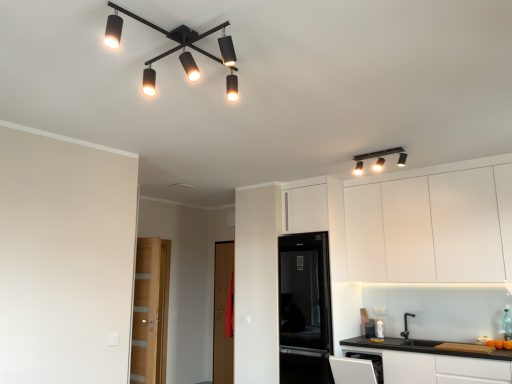
Question: Is brown wooden door at center aimed at white matte cabinet at upper right, which ranks as the first cabinetry in top-to-bottom order?

Choices:
 (A) no
 (B) yes

Answer: (A)

Question: Does brown wooden door at center come behind white matte cabinet at upper right, the 2th cabinetry when ordered from bottom to top?

Choices:
 (A) yes
 (B) no

Answer: (A)

Question: Would you consider brown wooden door at center to be distant from white matte cabinet at upper right, which ranks as the first cabinetry in top-to-bottom order?

Choices:
 (A) no
 (B) yes

Answer: (B)

Question: From a real-world perspective, is brown wooden door at center located beneath white matte cabinet at upper right, which ranks as the first cabinetry in top-to-bottom order?

Choices:
 (A) no
 (B) yes

Answer: (B)

Question: From the image's perspective, does brown wooden door at center appear lower than white matte cabinet at upper right, which ranks as the first cabinetry in top-to-bottom order?

Choices:
 (A) no
 (B) yes

Answer: (B)

Question: Based on their sizes in the image, would you say matte black light fixture at upper left is bigger or smaller than white matte cabinet at upper right, the 2th cabinetry when ordered from bottom to top?

Choices:
 (A) small
 (B) big

Answer: (A)

Question: In the image, is matte black light fixture at upper left positioned in front of or behind white matte cabinet at upper right, the 2th cabinetry when ordered from bottom to top?

Choices:
 (A) behind
 (B) front

Answer: (B)

Question: Is matte black light fixture at upper left situated inside white matte cabinet at upper right, which ranks as the first cabinetry in top-to-bottom order, or outside?

Choices:
 (A) outside
 (B) inside

Answer: (A)

Question: From a real-world perspective, relative to white matte cabinet at upper right, the 2th cabinetry when ordered from bottom to top, is matte black light fixture at upper left vertically above or below?

Choices:
 (A) above
 (B) below

Answer: (A)

Question: Choose the correct answer: Is white matte cabinet at lower right, arranged as the 1th cabinetry when ordered from the bottom, inside matte black light fixture at upper right or outside it?

Choices:
 (A) outside
 (B) inside

Answer: (A)

Question: In terms of height, does white matte cabinet at lower right, the 2th cabinetry from the top, look taller or shorter compared to matte black light fixture at upper right?

Choices:
 (A) short
 (B) tall

Answer: (B)

Question: Is white matte cabinet at lower right, the 2th cabinetry from the top, wider or thinner than matte black light fixture at upper right?

Choices:
 (A) thin
 (B) wide

Answer: (B)

Question: In the image, is white matte cabinet at lower right, the 2th cabinetry from the top, positioned in front of or behind matte black light fixture at upper right?

Choices:
 (A) front
 (B) behind

Answer: (A)

Question: Visually, is brown wooden door at center positioned to the left or to the right of light brown wooden door at left?

Choices:
 (A) left
 (B) right

Answer: (B)

Question: In terms of height, does brown wooden door at center look taller or shorter compared to light brown wooden door at left?

Choices:
 (A) short
 (B) tall

Answer: (B)